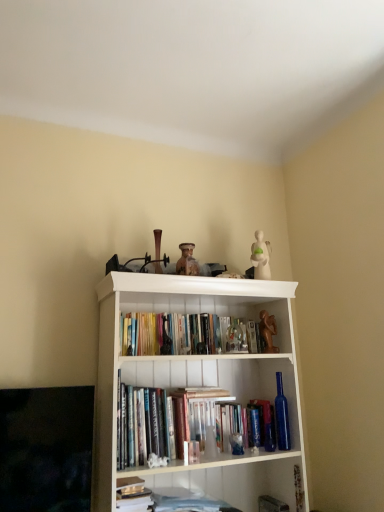
Find the location of a particular element. white paper stack at lower center, which is the first book in bottom-to-top order is located at coordinates (166, 498).

The height and width of the screenshot is (512, 384). I want to click on white matte bookcase at center, so click(192, 394).

What is the approximate width of white matte bookcase at center?

white matte bookcase at center is 16.62 inches in width.

This screenshot has height=512, width=384. What do you see at coordinates (268, 331) in the screenshot? I see `brown matte statue at upper center` at bounding box center [268, 331].

The width and height of the screenshot is (384, 512). What do you see at coordinates (186, 334) in the screenshot?
I see `hardcover books at center, which appears as the 3th book when ordered from the bottom` at bounding box center [186, 334].

The image size is (384, 512). Identify the location of hardcover book at lower center, the 2th book positioned from the bottom. (132, 495).

Can you confirm if brown matte statue at upper center is bigger than white matte bookcase at center?

Actually, brown matte statue at upper center might be smaller than white matte bookcase at center.

Would you say brown matte statue at upper center is outside white matte bookcase at center?

That's incorrect, brown matte statue at upper center is not completely outside white matte bookcase at center.

At what (x,y) coordinates should I click in order to perform the action: click on toy that appears behind the white matte bookcase at center. Please return your answer as a coordinate pair (x, y). Looking at the image, I should click on (268, 331).

In the scene shown: Is brown matte statue at upper center next to white matte bookcase at center?

No.

From a real-world perspective, is white matte bookcase at center above or below brown matte statue at upper center?

white matte bookcase at center is situated lower than brown matte statue at upper center in the real world.

Can you tell me how much white matte bookcase at center and brown matte statue at upper center differ in facing direction?

3.12 degrees.

From the image's perspective, is white matte bookcase at center above or below brown matte statue at upper center?

Clearly, from the image's perspective, white matte bookcase at center is below brown matte statue at upper center.

Which of these two, white matte bookcase at center or brown matte statue at upper center, is thinner?

Thinner between the two is brown matte statue at upper center.

Looking at the image, does hardcover books at center, which appears as the 3th book when ordered from the bottom, seem bigger or smaller compared to hardcover book at lower center, the second book positioned from the top?

Clearly, hardcover books at center, which appears as the 3th book when ordered from the bottom, is larger in size than hardcover book at lower center, the second book positioned from the top.

From the image's perspective, which object appears higher, hardcover books at center, placed as the 1th book when sorted from top to bottom, or hardcover book at lower center, the 2th book positioned from the bottom?

hardcover books at center, placed as the 1th book when sorted from top to bottom, from the image's perspective.

From a real-world perspective, is hardcover books at center, which appears as the 3th book when ordered from the bottom, above or below hardcover book at lower center, the 2th book positioned from the bottom?

Clearly, from a real-world perspective, hardcover books at center, which appears as the 3th book when ordered from the bottom, is above hardcover book at lower center, the 2th book positioned from the bottom.

In the scene shown: From a real-world perspective, relative to brown matte statue at upper center, is hardcover book at lower center, the 2th book positioned from the bottom, vertically above or below?

Clearly, from a real-world perspective, hardcover book at lower center, the 2th book positioned from the bottom, is below brown matte statue at upper center.

From their relative heights in the image, would you say hardcover book at lower center, the second book positioned from the top, is taller or shorter than brown matte statue at upper center?

In the image, hardcover book at lower center, the second book positioned from the top, appears to be shorter than brown matte statue at upper center.

Considering the relative positions of hardcover book at lower center, the 2th book positioned from the bottom, and brown matte statue at upper center in the image provided, is hardcover book at lower center, the 2th book positioned from the bottom, to the left of brown matte statue at upper center from the viewer's perspective?

Yes.

From the image's perspective, is hardcover book at lower center, the second book positioned from the top, positioned above or below brown matte statue at upper center?

hardcover book at lower center, the second book positioned from the top, is situated lower than brown matte statue at upper center in the image.

Consider the image. Can you tell me how much white paper stack at lower center, the third book viewed from the top, and hardcover books at center, which appears as the 3th book when ordered from the bottom, differ in facing direction?

The facing directions of white paper stack at lower center, the third book viewed from the top, and hardcover books at center, which appears as the 3th book when ordered from the bottom, are 0.574 degrees apart.

From the image's perspective, which is above, white paper stack at lower center, which is the first book in bottom-to-top order, or hardcover books at center, placed as the 1th book when sorted from top to bottom?

From the image's view, hardcover books at center, placed as the 1th book when sorted from top to bottom, is above.

Who is taller, white paper stack at lower center, the third book viewed from the top, or hardcover books at center, which appears as the 3th book when ordered from the bottom?

With more height is hardcover books at center, which appears as the 3th book when ordered from the bottom.

Is hardcover books at center, placed as the 1th book when sorted from top to bottom, located within white paper stack at lower center, which is the first book in bottom-to-top order?

No, hardcover books at center, placed as the 1th book when sorted from top to bottom, is located outside of white paper stack at lower center, which is the first book in bottom-to-top order.

Does hardcover book at center have a lesser width compared to white paper stack at lower center, the third book viewed from the top?

Yes, hardcover book at center is thinner than white paper stack at lower center, the third book viewed from the top.

Consider the image. From the image's perspective, would you say hardcover book at center is shown under white paper stack at lower center, which is the first book in bottom-to-top order?

Incorrect, from the image's perspective, hardcover book at center is higher than white paper stack at lower center, which is the first book in bottom-to-top order.

Based on the photo, is brown matte statue at upper center further to camera compared to hardcover books at center, placed as the 1th book when sorted from top to bottom?

Yes, brown matte statue at upper center is further from the viewer.

From the image's perspective, is brown matte statue at upper center located above or below hardcover books at center, which appears as the 3th book when ordered from the bottom?

brown matte statue at upper center is situated lower than hardcover books at center, which appears as the 3th book when ordered from the bottom, in the image.

Between brown matte statue at upper center and hardcover books at center, placed as the 1th book when sorted from top to bottom, which one has larger width?

Wider between the two is hardcover books at center, placed as the 1th book when sorted from top to bottom.

The width and height of the screenshot is (384, 512). In order to click on bookcase in front of the brown matte statue at upper center in this screenshot , I will do (x=192, y=394).

The width and height of the screenshot is (384, 512). I want to click on bookcase located underneath the brown matte statue at upper center (from a real-world perspective), so pos(192,394).

Which object lies nearer to the anchor point white matte bookcase at center, hardcover books at center, placed as the 1th book when sorted from top to bottom, or hardcover book at center?

hardcover books at center, placed as the 1th book when sorted from top to bottom, is closer to white matte bookcase at center.

Considering their positions, is hardcover books at center, placed as the 1th book when sorted from top to bottom, positioned further to brown matte statue at upper center than hardcover book at lower center, the 2th book positioned from the bottom?

The object further to brown matte statue at upper center is hardcover book at lower center, the 2th book positioned from the bottom.

Which object lies further to the anchor point white matte bookcase at center, hardcover book at center or white paper stack at lower center, the third book viewed from the top?

hardcover book at center lies further to white matte bookcase at center than the other object.

From the image, which object appears to be farther from white paper stack at lower center, the third book viewed from the top, brown matte statue at upper center or hardcover book at center?

brown matte statue at upper center.

Based on their spatial positions, is hardcover books at center, which appears as the 3th book when ordered from the bottom, or hardcover book at center further from brown matte statue at upper center?

The object further to brown matte statue at upper center is hardcover book at center.

Based on their spatial positions, is white matte bookcase at center or white paper stack at lower center, the third book viewed from the top, closer to hardcover book at center?

white matte bookcase at center is closer to hardcover book at center.

Estimate the real-world distances between objects in this image. Which object is closer to white matte bookcase at center, white paper stack at lower center, which is the first book in bottom-to-top order, or hardcover book at center?

white paper stack at lower center, which is the first book in bottom-to-top order, lies closer to white matte bookcase at center than the other object.

Which object lies further to the anchor point brown matte statue at upper center, hardcover book at center or white matte bookcase at center?

Based on the image, white matte bookcase at center appears to be further to brown matte statue at upper center.

Find the location of a particular element. The image size is (384, 512). toy between hardcover books at center, placed as the 1th book when sorted from top to bottom, and hardcover book at lower center, the 2th book positioned from the bottom, in the vertical direction is located at coordinates (268, 331).

Identify the location of toy between hardcover books at center, placed as the 1th book when sorted from top to bottom, and white paper stack at lower center, which is the first book in bottom-to-top order, in the up-down direction. The image size is (384, 512). (268, 331).

Locate an element on the screen. The height and width of the screenshot is (512, 384). bookcase located between hardcover book at lower center, the 2th book positioned from the bottom, and hardcover book at center in the left-right direction is located at coordinates (192, 394).

Locate an element on the screen. paperback book between hardcover book at lower center, the 2th book positioned from the bottom, and brown matte statue at upper center from left to right is located at coordinates (266, 423).